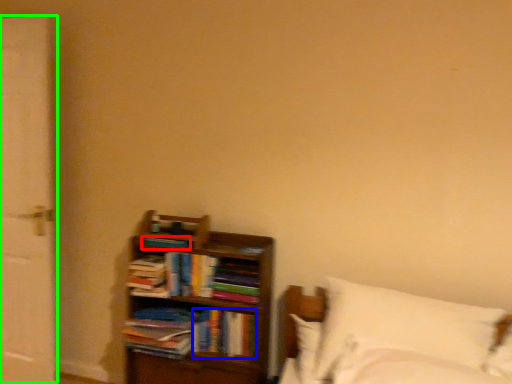
Question: Which object is positioned closest to book (highlighted by a red box)? Select from book (highlighted by a blue box) and screen door (highlighted by a green box).

Choices:
 (A) book
 (B) screen door

Answer: (A)